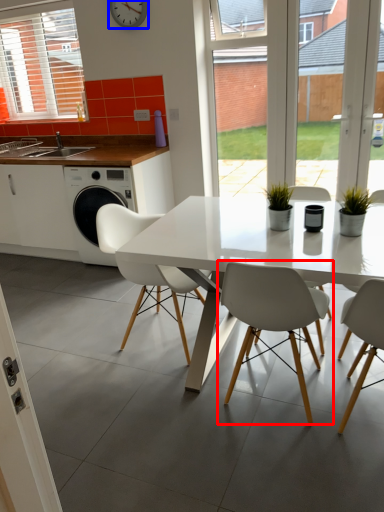
Question: Which point is further to the camera, chair (highlighted by a red box) or clock (highlighted by a blue box)?

Choices:
 (A) chair
 (B) clock

Answer: (B)